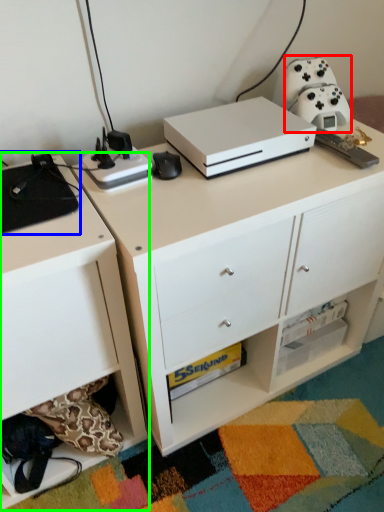
Question: Estimate the real-world distances between objects in this image. Which object is closer to appliance (highlighted by a red box), appliance (highlighted by a blue box) or chest of drawers (highlighted by a green box)?

Choices:
 (A) appliance
 (B) chest of drawers

Answer: (A)